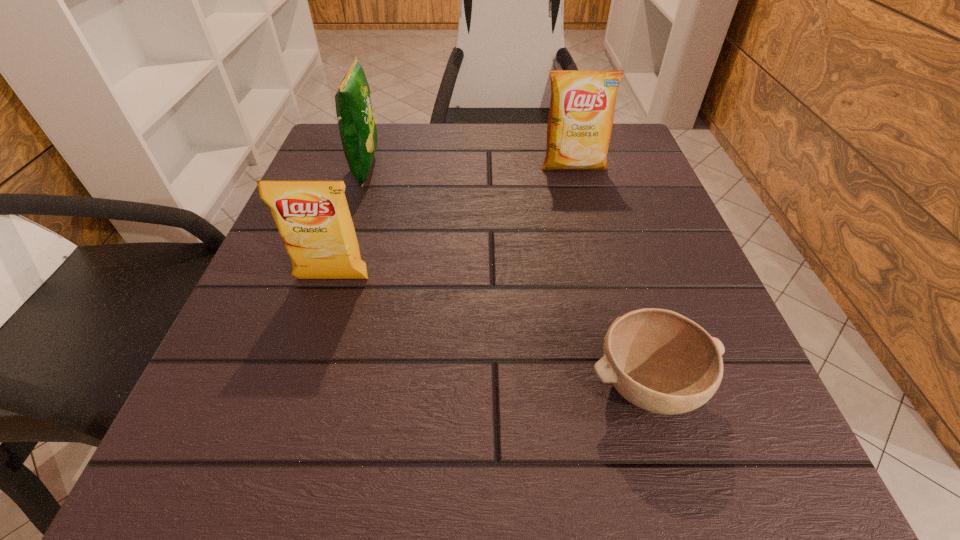
Locate an element on the screen. the rightmost crisp (potato chip) is located at coordinates (582, 105).

Where is `the third farthest object`? The height and width of the screenshot is (540, 960). the third farthest object is located at coordinates point(313,218).

Locate an element on the screen. The width and height of the screenshot is (960, 540). the nearest object is located at coordinates (659, 360).

Where is `bowl`? bowl is located at coordinates (659, 360).

The width and height of the screenshot is (960, 540). Find the location of `free space located on the front-facing side of the rightmost crisp (potato chip)`. free space located on the front-facing side of the rightmost crisp (potato chip) is located at coordinates (584, 204).

You are a GUI agent. You are given a task and a screenshot of the screen. Output one action in this format:
    pyautogui.click(x=<x>, y=<y>)
    Task: Click on the free space located on the front of the third farthest object with the logo
    This screenshot has height=540, width=960.
    Given the screenshot: What is the action you would take?
    pyautogui.click(x=275, y=458)

The height and width of the screenshot is (540, 960). What are the coordinates of `vacant area situated on the left of the shortest object` in the screenshot? It's located at (371, 385).

At what (x,y) coordinates should I click in order to perform the action: click on object at the near edge. Please return your answer as a coordinate pair (x, y). This screenshot has width=960, height=540. Looking at the image, I should click on (659, 360).

Where is `crisp (potato chip) that is at the right edge`? The width and height of the screenshot is (960, 540). crisp (potato chip) that is at the right edge is located at coordinates (582, 105).

This screenshot has height=540, width=960. What are the coordinates of `bowl that is at the right edge` in the screenshot? It's located at (659, 360).